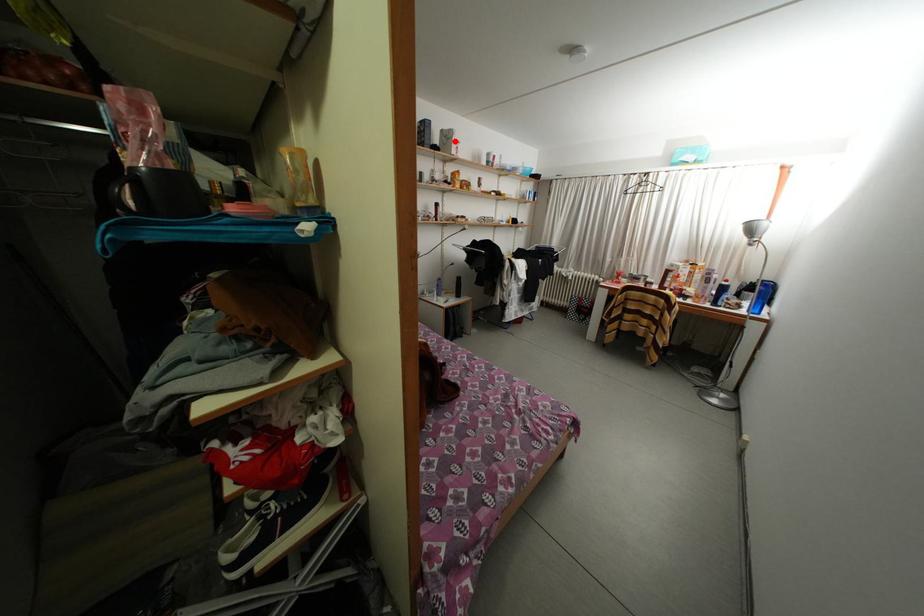
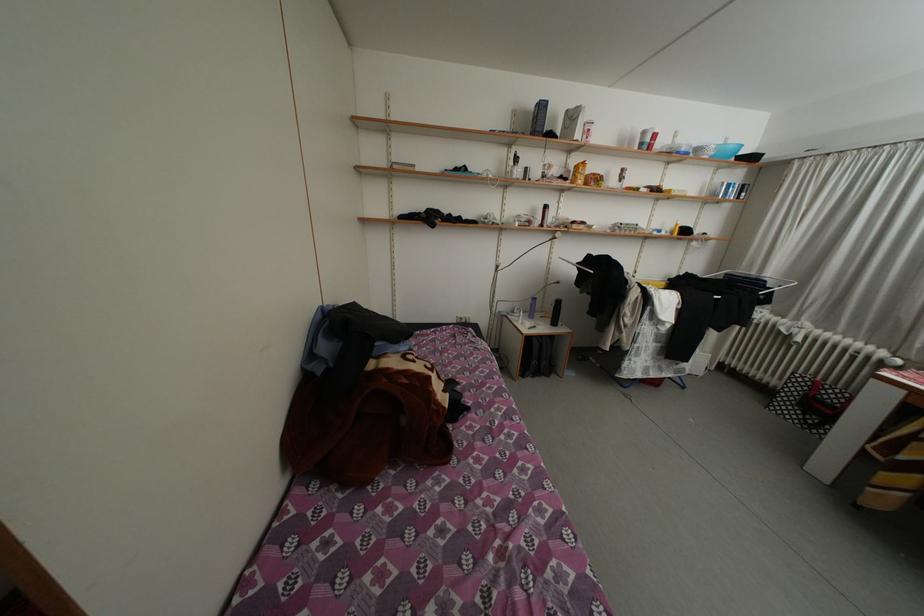
Locate, in the second image, the point that corresponds to the highlighted location in the first image.

(580, 122)